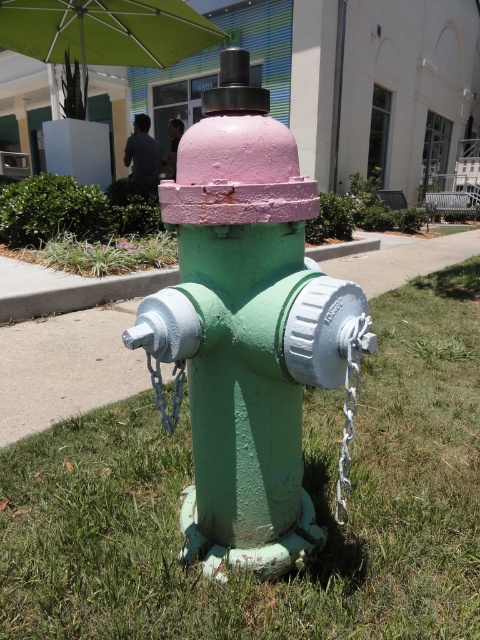
Which is more to the left, silver metallic chain at lower center or metallic chain at center?

metallic chain at center

Is silver metallic chain at lower center smaller than metallic chain at center?

No.

Where is `silver metallic chain at lower center`? silver metallic chain at lower center is located at coordinates (350, 406).

Is pink matte fire hydrant at center taller than green fabric umbrella at upper center?

Correct, pink matte fire hydrant at center is much taller as green fabric umbrella at upper center.

Between pink matte fire hydrant at center and green fabric umbrella at upper center, which one has more height?

Standing taller between the two is pink matte fire hydrant at center.

Where is `pink matte fire hydrant at center`? Image resolution: width=480 pixels, height=640 pixels. pink matte fire hydrant at center is located at coordinates (247, 328).

The image size is (480, 640). What do you see at coordinates (303, 484) in the screenshot?
I see `green matte grass at lower center` at bounding box center [303, 484].

Does green matte grass at lower center have a lesser width compared to green painted concrete curb at lower center?

Incorrect, green matte grass at lower center's width is not less than green painted concrete curb at lower center's.

Between point (309, 406) and point (4, 266), which one is positioned behind?

Point (4, 266)

I want to click on green matte grass at lower center, so click(x=303, y=484).